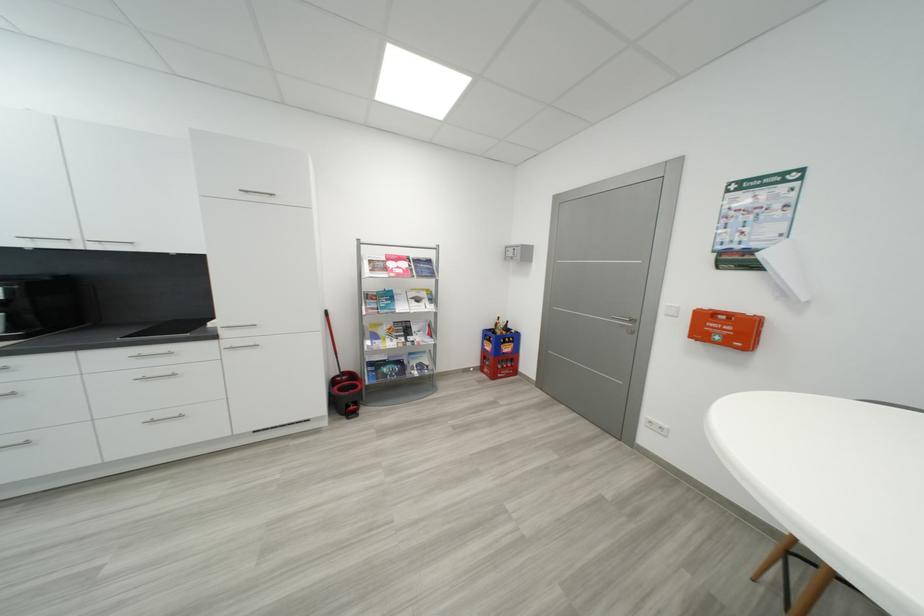
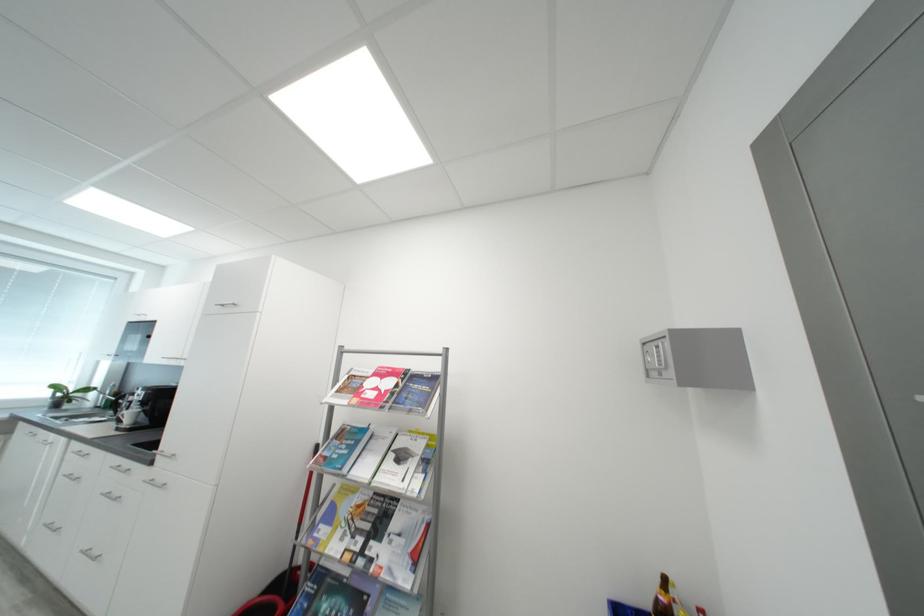
Find the pixel in the second image that matches pixel 520 256 in the first image.

(666, 362)